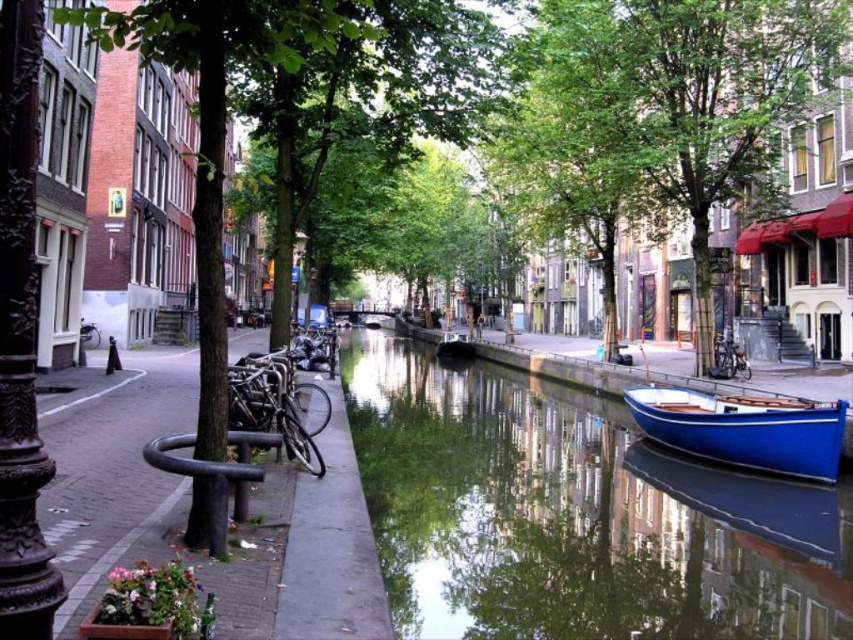
Question: Which of the following is the closest to the observer?

Choices:
 (A) (773, 444)
 (B) (73, 561)

Answer: (B)

Question: Which object is farther from the camera taking this photo?

Choices:
 (A) white painted line at lower left
 (B) brown concrete pavement at lower left
 (C) blue polished wood boat at lower right
 (D) green reflective water at center

Answer: (C)

Question: Can you confirm if green reflective water at center is positioned above metallic silver lamp post at center?

Choices:
 (A) yes
 (B) no

Answer: (B)

Question: Can you confirm if green reflective water at center is smaller than brown concrete pavement at lower left?

Choices:
 (A) yes
 (B) no

Answer: (B)

Question: Does green reflective water at center have a greater width compared to brown concrete pavement at lower left?

Choices:
 (A) no
 (B) yes

Answer: (B)

Question: Which point is farther to the camera?

Choices:
 (A) green reflective water at center
 (B) metallic silver lamp post at center
 (C) blue glossy boat at center

Answer: (C)